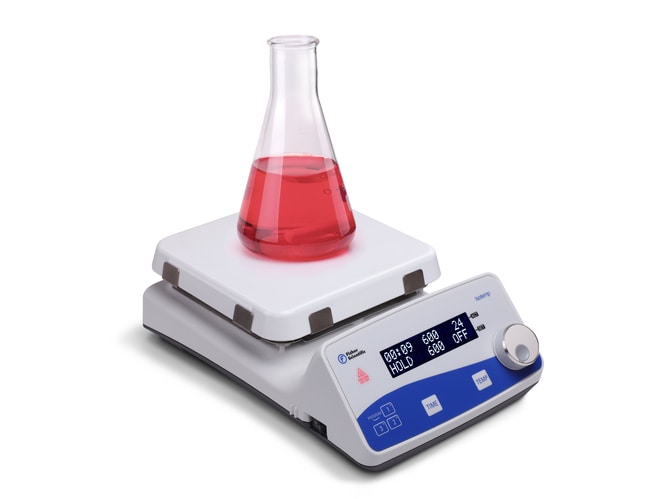
Find the location of a particular element. This screenshot has width=650, height=499. white button that says "time" in blue is located at coordinates [433, 403].